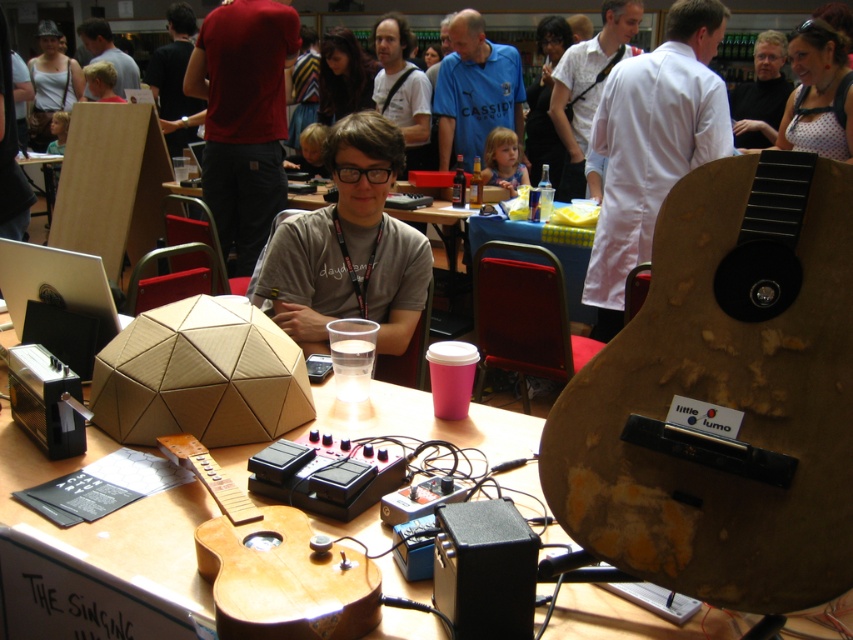
Question: Which of the following is the farthest from the observer?

Choices:
 (A) (405, 22)
 (B) (172, 13)
 (C) (381, 259)
 (D) (700, 8)

Answer: (B)

Question: Which point is closer to the camera?

Choices:
 (A) matte gray shirt at center
 (B) matte white shirt at center
 (C) blue jersey at center

Answer: (A)

Question: Where is wooden acoustic guitar at center located in relation to wooden table at center in the image?

Choices:
 (A) right
 (B) left

Answer: (B)

Question: Can you confirm if wooden acoustic guitar at center is positioned above matte white shirt at center?

Choices:
 (A) no
 (B) yes

Answer: (A)

Question: Does wooden acoustic guitar at center appear over matte red shirt at upper center?

Choices:
 (A) yes
 (B) no

Answer: (B)

Question: Which object appears closest to the camera in this image?

Choices:
 (A) wooden acoustic guitar at right
 (B) black matte speaker at lower center
 (C) wooden table at center
 (D) wooden acoustic guitar at center

Answer: (A)